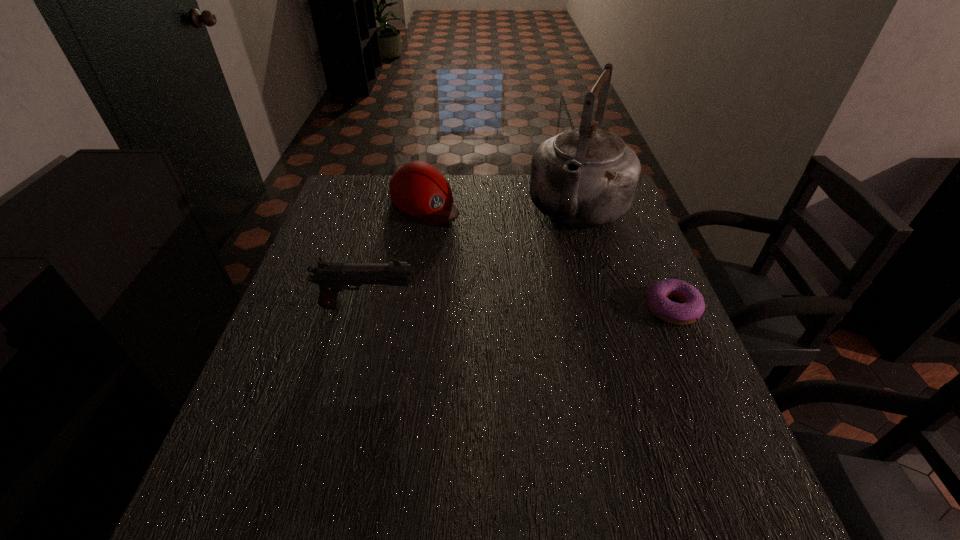
I want to click on vacant space at the left edge of the desktop, so click(x=312, y=341).

Identify the location of free space at the right edge of the desktop. The image size is (960, 540). (632, 244).

Where is `vacant space at the far left corner of the desktop`? The height and width of the screenshot is (540, 960). vacant space at the far left corner of the desktop is located at coordinates (383, 198).

At what (x,y) coordinates should I click in order to perform the action: click on vacant space in between the tallest object and the baseball cap. Please return your answer as a coordinate pair (x, y). The height and width of the screenshot is (540, 960). Looking at the image, I should click on (502, 206).

You are a GUI agent. You are given a task and a screenshot of the screen. Output one action in this format:
    pyautogui.click(x=<x>, y=<y>)
    Task: Click on the vacant space in between the second shortest object and the shortest object
    This screenshot has height=540, width=960.
    Given the screenshot: What is the action you would take?
    pyautogui.click(x=548, y=255)

This screenshot has height=540, width=960. Identify the location of free space between the third tallest object and the kettle. [x=502, y=206].

Identify the location of free point between the baseball cap and the shortest object. The width and height of the screenshot is (960, 540). (548, 255).

Find the location of a particular element. Image resolution: width=960 pixels, height=540 pixels. empty space between the baseball cap and the doughnut is located at coordinates point(548,255).

This screenshot has width=960, height=540. I want to click on vacant area that lies between the doughnut and the third tallest object, so click(x=548, y=255).

Identify the location of free space between the second shortest object and the doughnut. (548, 255).